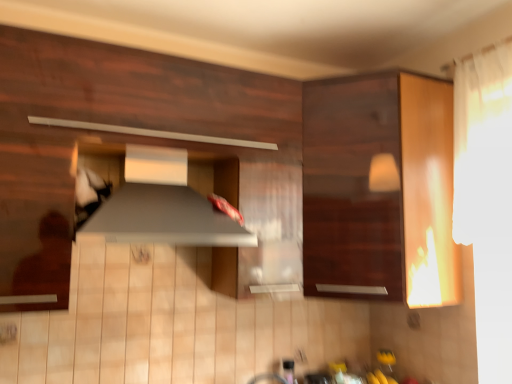
Question: Considering the relative sizes of matte wood cabinet at center, placed as the second cabinetry when sorted from right to left, and wooden cabinet at right, which ranks as the second cabinetry in left-to-right order, in the image provided, is matte wood cabinet at center, placed as the second cabinetry when sorted from right to left, shorter than wooden cabinet at right, which ranks as the second cabinetry in left-to-right order,?

Choices:
 (A) no
 (B) yes

Answer: (B)

Question: From a real-world perspective, is matte wood cabinet at center, marked as the 1th cabinetry in a left-to-right arrangement, located beneath wooden cabinet at right, which ranks as the second cabinetry in left-to-right order?

Choices:
 (A) no
 (B) yes

Answer: (A)

Question: Is matte wood cabinet at center, marked as the 1th cabinetry in a left-to-right arrangement, beside wooden cabinet at right, the 1th cabinetry when ordered from right to left?

Choices:
 (A) yes
 (B) no

Answer: (B)

Question: Would you say matte wood cabinet at center, marked as the 1th cabinetry in a left-to-right arrangement, is outside wooden cabinet at right, the 1th cabinetry when ordered from right to left?

Choices:
 (A) yes
 (B) no

Answer: (A)

Question: Is matte wood cabinet at center, placed as the second cabinetry when sorted from right to left, at the right side of wooden cabinet at right, which ranks as the second cabinetry in left-to-right order?

Choices:
 (A) yes
 (B) no

Answer: (B)

Question: Considering their positions, is wooden cabinet at right, which ranks as the second cabinetry in left-to-right order, located in front of or behind matte wood cabinet at center, placed as the second cabinetry when sorted from right to left?

Choices:
 (A) front
 (B) behind

Answer: (B)

Question: Considering the positions of wooden cabinet at right, the 1th cabinetry when ordered from right to left, and matte wood cabinet at center, placed as the second cabinetry when sorted from right to left, in the image, is wooden cabinet at right, the 1th cabinetry when ordered from right to left, taller or shorter than matte wood cabinet at center, placed as the second cabinetry when sorted from right to left,?

Choices:
 (A) tall
 (B) short

Answer: (A)

Question: Considering the positions of point (445, 223) and point (61, 292), is point (445, 223) closer or farther from the camera than point (61, 292)?

Choices:
 (A) farther
 (B) closer

Answer: (A)

Question: Is wooden cabinet at right, the 1th cabinetry when ordered from right to left, inside the boundaries of matte wood cabinet at center, placed as the second cabinetry when sorted from right to left, or outside?

Choices:
 (A) inside
 (B) outside

Answer: (B)

Question: Is matte wood cabinet at center, marked as the 1th cabinetry in a left-to-right arrangement, wider or thinner than wooden cabinet at right, which ranks as the second cabinetry in left-to-right order?

Choices:
 (A) wide
 (B) thin

Answer: (B)

Question: Does point (238, 99) appear closer or farther from the camera than point (391, 89)?

Choices:
 (A) farther
 (B) closer

Answer: (B)

Question: Considering the relative positions of matte wood cabinet at center, placed as the second cabinetry when sorted from right to left, and wooden cabinet at right, which ranks as the second cabinetry in left-to-right order, in the image provided, is matte wood cabinet at center, placed as the second cabinetry when sorted from right to left, to the left or to the right of wooden cabinet at right, which ranks as the second cabinetry in left-to-right order,?

Choices:
 (A) left
 (B) right

Answer: (A)

Question: From a real-world perspective, is matte wood cabinet at center, placed as the second cabinetry when sorted from right to left, physically located above or below wooden cabinet at right, the 1th cabinetry when ordered from right to left?

Choices:
 (A) above
 (B) below

Answer: (A)

Question: Considering their positions, is satin silver exhaust hood at center located in front of or behind wooden cabinet at right, which ranks as the second cabinetry in left-to-right order?

Choices:
 (A) front
 (B) behind

Answer: (A)

Question: Looking at their shapes, would you say satin silver exhaust hood at center is wider or thinner than wooden cabinet at right, which ranks as the second cabinetry in left-to-right order?

Choices:
 (A) thin
 (B) wide

Answer: (A)